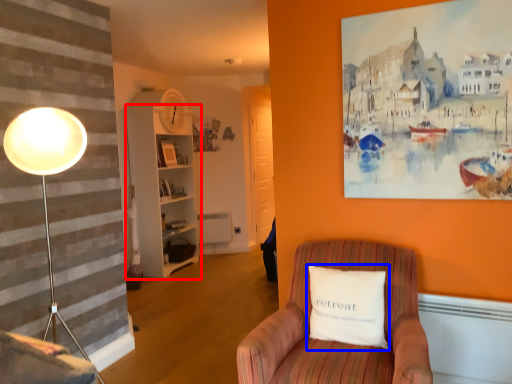
Question: Which object is closer to the camera taking this photo, bookshelf (highlighted by a red box) or pillow (highlighted by a blue box)?

Choices:
 (A) bookshelf
 (B) pillow

Answer: (B)